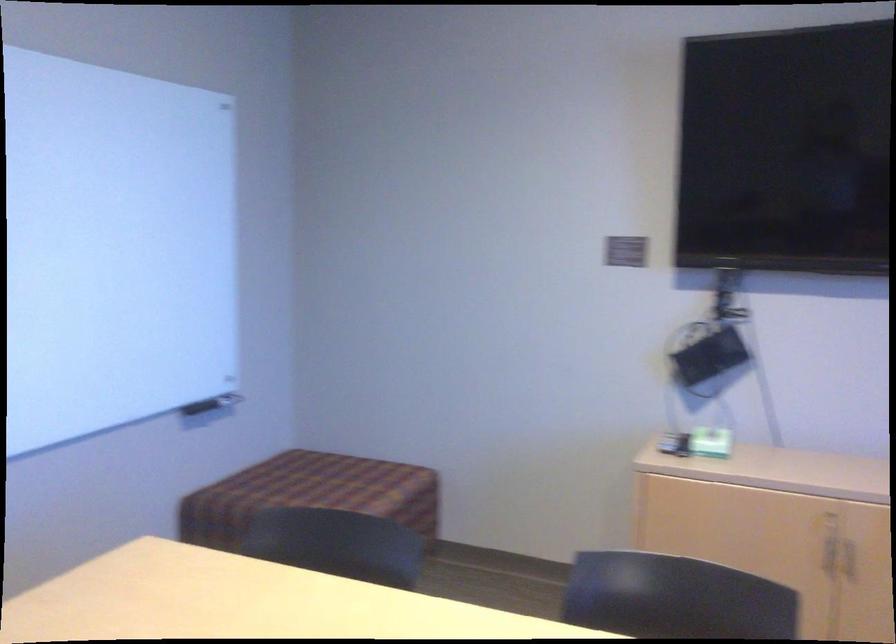
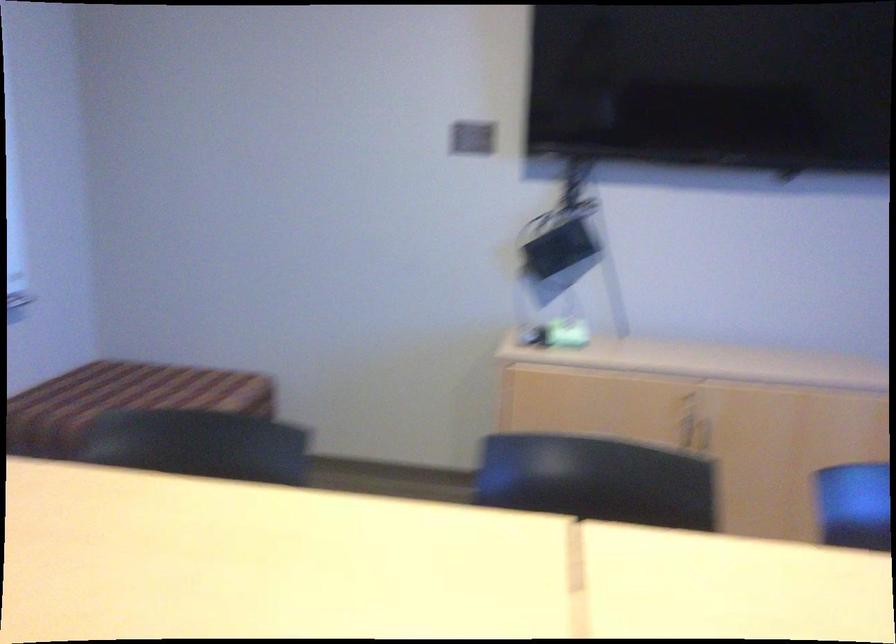
Question: The images are taken continuously from a first-person perspective. In which direction is your viewpoint rotating?

Choices:
 (A) Left
 (B) Right
 (C) Up
 (D) Down

Answer: (B)